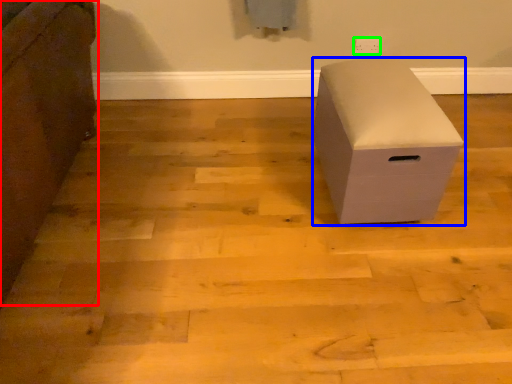
Question: Which object is the farthest from furniture (highlighted by a red box)? Choose among these: furniture (highlighted by a blue box) or electric outlet (highlighted by a green box).

Choices:
 (A) furniture
 (B) electric outlet

Answer: (B)